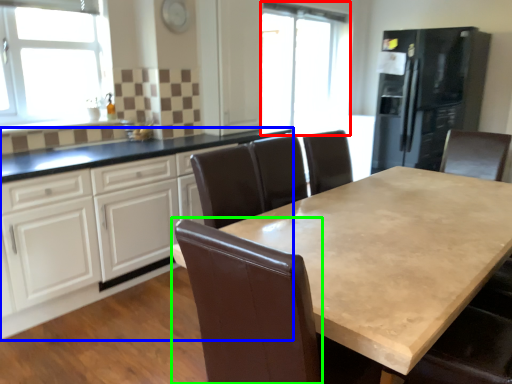
Question: Estimate the real-world distances between objects in this image. Which object is farther from window screen (highlighted by a red box), cabinetry (highlighted by a blue box) or swivel chair (highlighted by a green box)?

Choices:
 (A) cabinetry
 (B) swivel chair

Answer: (B)